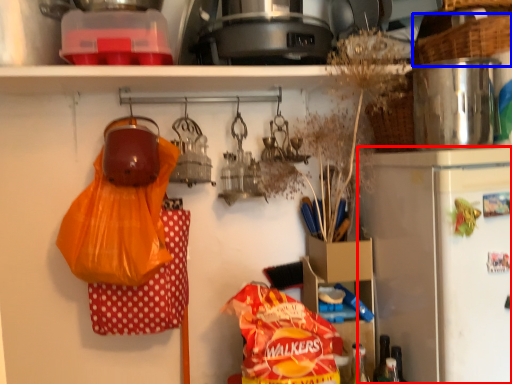
Question: Which of the following is the closest to the observer, refrigerator (highlighted by a red box) or basket (highlighted by a blue box)?

Choices:
 (A) refrigerator
 (B) basket

Answer: (A)